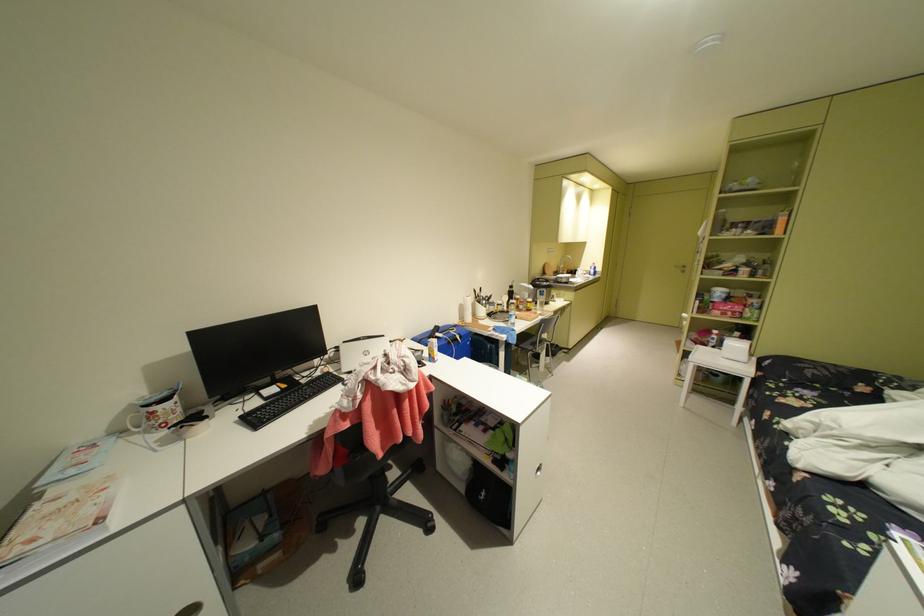
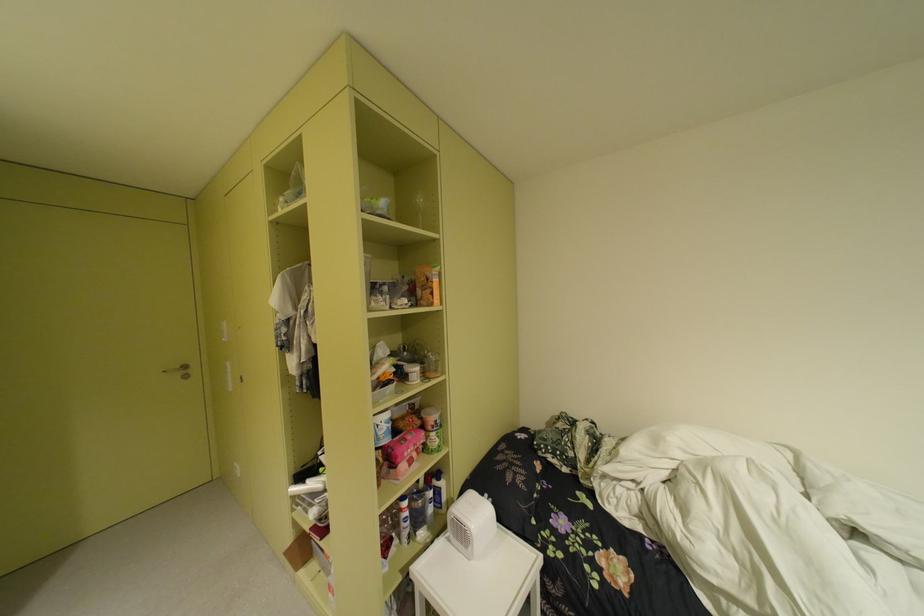
Find the pixel in the second image that matches the point at 762,275 in the first image.

(434, 376)